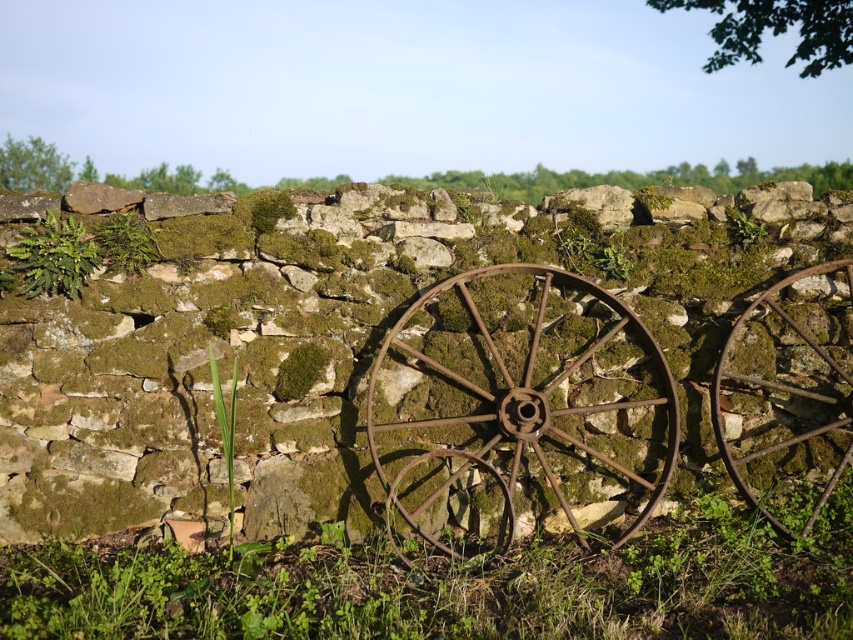
Consider the image. You are a gardener who wants to plant a new flower in the scene. The flower requires a spot that is taller than the green leafy grass at lower center but shorter than the green mossy plant at upper left. Can you find such a location based on the scene description?

The green leafy grass at lower center is shorter than the green mossy plant at upper left, so there is no location that is both taller than the green leafy grass at lower center and shorter than the green mossy plant at upper left. The flower cannot be planted in this scene based on the given requirements.

You are a gardener trying to plant a new shrub that requires a space wider than the green mossy plant at upper left. Can the green leafy grass at lower center provide enough space for the shrub?

The green leafy grass at lower center might be wider than the green mossy plant at upper left, so it could potentially provide enough space for the shrub if the grass area is indeed wider.